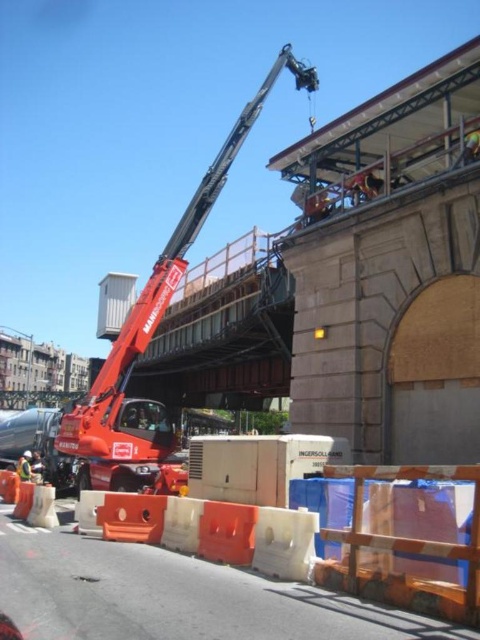
Question: Which object is farther from the camera taking this photo?

Choices:
 (A) transparent plastic barricade at lower center
 (B) red metallic crane at center

Answer: (B)

Question: Is red metallic crane at center below transparent plastic barricade at lower center?

Choices:
 (A) yes
 (B) no

Answer: (B)

Question: Which object appears closest to the camera in this image?

Choices:
 (A) white plastic container at upper center
 (B) transparent plastic barricade at lower center
 (C) red metallic crane at center

Answer: (B)

Question: Does transparent plastic barricade at lower center appear over white plastic container at upper center?

Choices:
 (A) yes
 (B) no

Answer: (B)

Question: Can you confirm if red metallic crane at center is thinner than white plastic container at upper center?

Choices:
 (A) yes
 (B) no

Answer: (A)

Question: Which object is closer to the camera taking this photo?

Choices:
 (A) white plastic container at upper center
 (B) transparent plastic barricade at lower center
 (C) red metallic crane at center

Answer: (B)